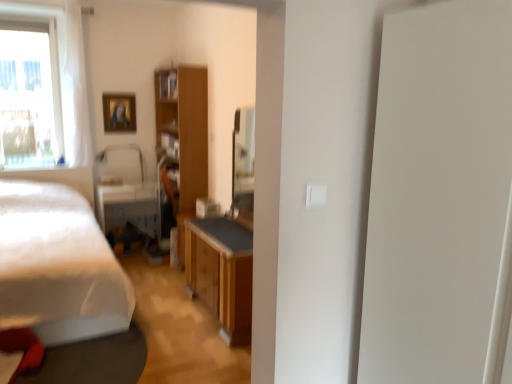
Question: Is white matte bed at left behind matte black swivel chair at center?

Choices:
 (A) no
 (B) yes

Answer: (A)

Question: Is white matte bed at left far away from matte black swivel chair at center?

Choices:
 (A) no
 (B) yes

Answer: (B)

Question: Considering the relative sizes of white matte bed at left and matte black swivel chair at center in the image provided, is white matte bed at left bigger than matte black swivel chair at center?

Choices:
 (A) no
 (B) yes

Answer: (B)

Question: From a real-world perspective, is white matte bed at left on matte black swivel chair at center?

Choices:
 (A) no
 (B) yes

Answer: (B)

Question: Is white matte bed at left aimed at matte black swivel chair at center?

Choices:
 (A) yes
 (B) no

Answer: (B)

Question: Is white matte bed at left outside of matte black swivel chair at center?

Choices:
 (A) no
 (B) yes

Answer: (B)

Question: Is transparent glass window at upper left at the right side of white matte bed at left?

Choices:
 (A) no
 (B) yes

Answer: (A)

Question: From a real-world perspective, is transparent glass window at upper left positioned under white matte bed at left based on gravity?

Choices:
 (A) no
 (B) yes

Answer: (A)

Question: From a real-world perspective, is transparent glass window at upper left on top of white matte bed at left?

Choices:
 (A) yes
 (B) no

Answer: (A)

Question: Is transparent glass window at upper left positioned beyond the bounds of white matte bed at left?

Choices:
 (A) no
 (B) yes

Answer: (B)

Question: Is transparent glass window at upper left in contact with white matte bed at left?

Choices:
 (A) yes
 (B) no

Answer: (B)

Question: Is transparent glass window at upper left oriented towards white matte bed at left?

Choices:
 (A) no
 (B) yes

Answer: (A)

Question: Is wooden cabinet at center further to camera compared to transparent glass window at upper left?

Choices:
 (A) yes
 (B) no

Answer: (A)